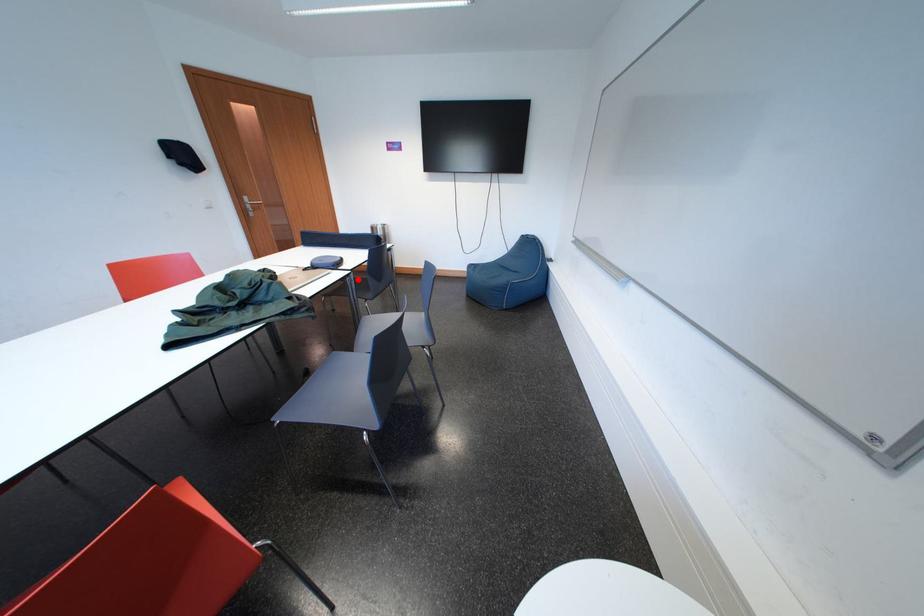
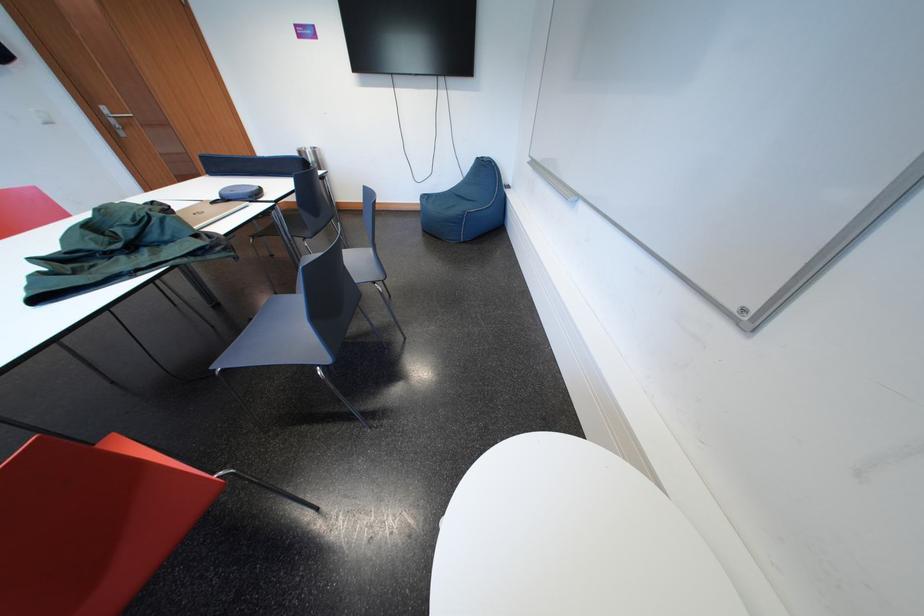
Where in the second image is the point corresponding to the highlighted location from the first image?

(283, 213)